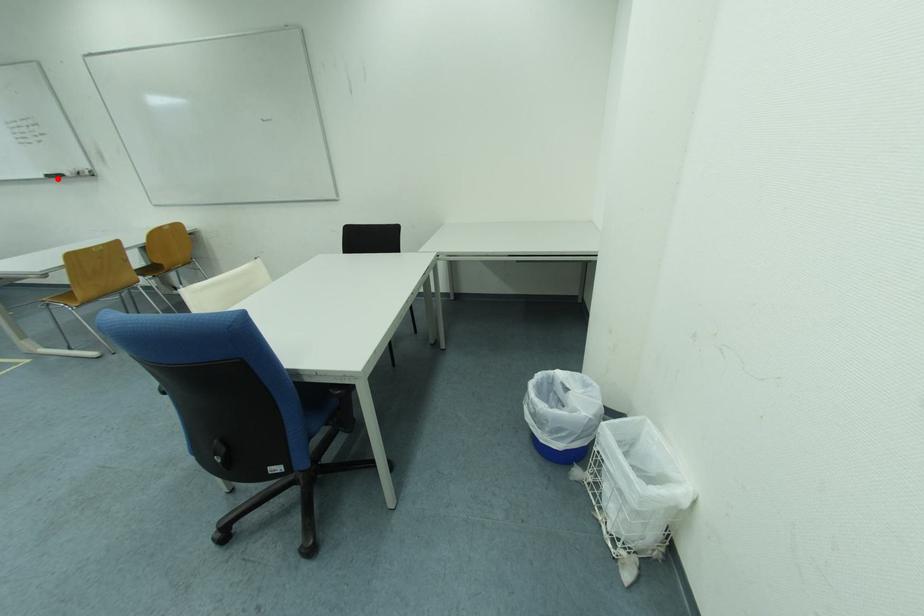
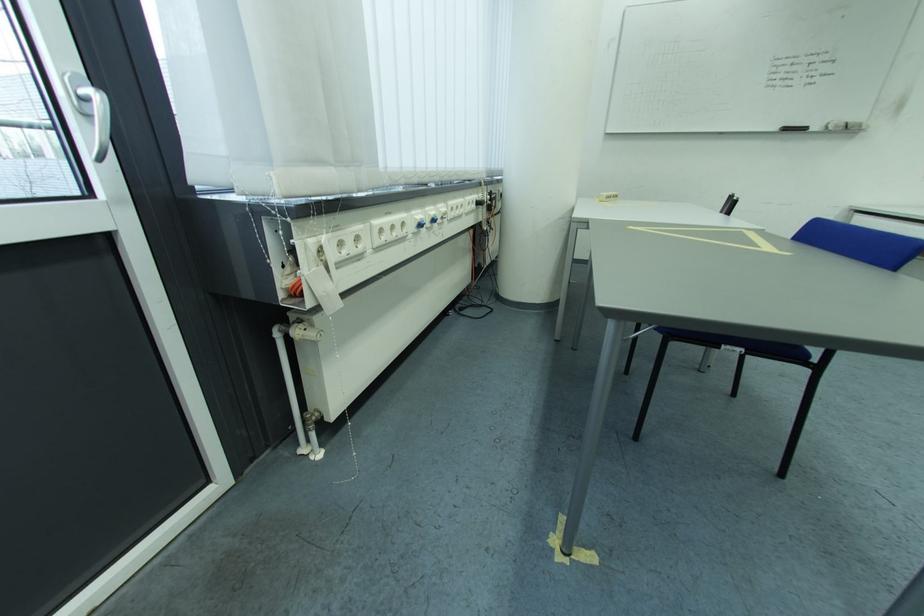
Question: I am providing you with two images of the same scene from different viewpoints. Given a red point in image1, look at the same physical point in image2. Is it:

Choices:
 (A) Closer to the viewpoint
 (B) Farther from the viewpoint

Answer: (A)